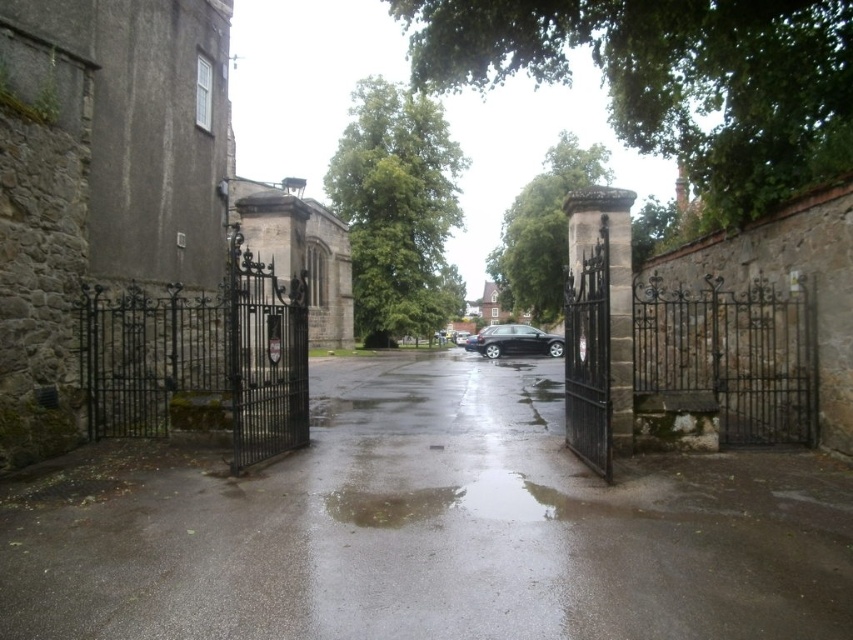
Question: From the image, what is the correct spatial relationship of glossy asphalt alley at center in relation to glossy black car at center?

Choices:
 (A) below
 (B) above

Answer: (A)

Question: From the image, what is the correct spatial relationship of glossy asphalt alley at center in relation to glossy black car at center?

Choices:
 (A) left
 (B) right

Answer: (A)

Question: Is glossy asphalt alley at center to the right of glossy black car at center from the viewer's perspective?

Choices:
 (A) yes
 (B) no

Answer: (B)

Question: Which point is closer to the camera?

Choices:
 (A) glossy asphalt alley at center
 (B) glossy black car at center

Answer: (A)